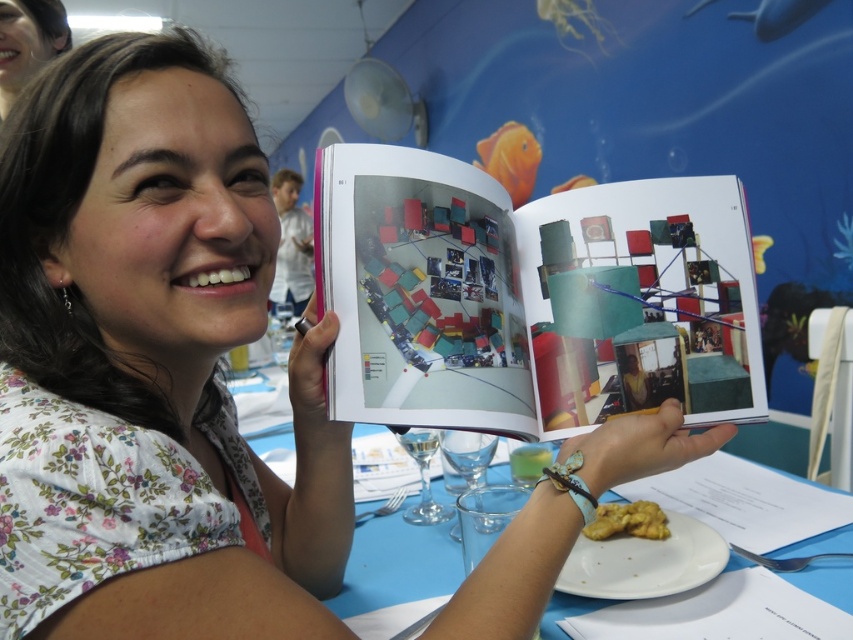
You are standing at the position of point (x=456, y=458) and want to move to the position of point (x=288, y=436). Which direction should you move to reach there?

You should move forward because point (x=288, y=436) is behind point (x=456, y=458), meaning it is in the direction you are facing.

You are a guest at this event and want to pick up the golden crumbly pastry at center without closing the matte plastic book at center. Is it possible to do so?

The matte plastic book at center is positioned over the golden crumbly pastry at center, so you cannot pick up the pastry without moving the book first.

You are organizing a small event and need to place a decorative item on the table. The matte plastic book at center and the golden crumbly pastry at center are both options. Which one should you choose if you want the item to be larger?

The matte plastic book at center is bigger than the golden crumbly pastry at center, so you should choose the matte plastic book at center if you want a larger decorative item.